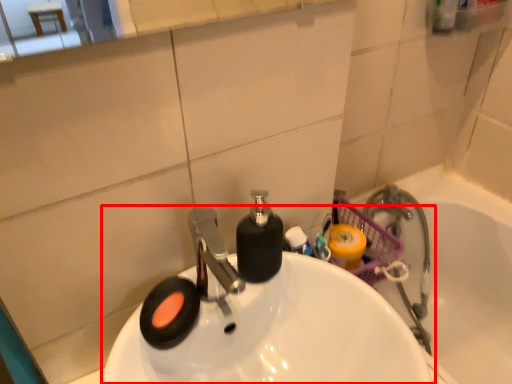
Question: From the image's perspective, where is sink (annotated by the red box) located in relation to bath in the image?

Choices:
 (A) below
 (B) above

Answer: (B)